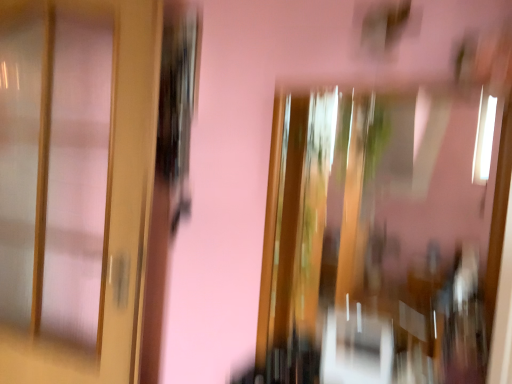
The width and height of the screenshot is (512, 384). In order to click on matte wood door at left in this screenshot , I will do [112, 204].

What do you see at coordinates (112, 204) in the screenshot? I see `matte wood door at left` at bounding box center [112, 204].

Measure the distance between matte wood door at left and camera.

The distance of matte wood door at left from camera is 1.28 meters.

What do you see at coordinates (383, 234) in the screenshot? The width and height of the screenshot is (512, 384). I see `transparent glass window at center` at bounding box center [383, 234].

The height and width of the screenshot is (384, 512). Identify the location of transparent glass window at center. (383, 234).

Identify the location of matte wood door at left. (112, 204).

Is transparent glass window at center at the right side of matte wood door at left?

Correct, you'll find transparent glass window at center to the right of matte wood door at left.

Is transparent glass window at center closer to the viewer compared to matte wood door at left?

Yes, transparent glass window at center is closer to the camera.

Is point (329, 192) farther from viewer compared to point (145, 77)?

Yes, it is.

From the image's perspective, which one is positioned higher, transparent glass window at center or matte wood door at left?

From the image's view, matte wood door at left is above.

From a real-world perspective, between transparent glass window at center and matte wood door at left, who is vertically lower?

transparent glass window at center, from a real-world perspective.

Looking at their sizes, would you say transparent glass window at center is wider or thinner than matte wood door at left?

Clearly, transparent glass window at center has less width compared to matte wood door at left.

Considering the relative sizes of transparent glass window at center and matte wood door at left in the image provided, is transparent glass window at center taller than matte wood door at left?

In fact, transparent glass window at center may be shorter than matte wood door at left.

Who is bigger, transparent glass window at center or matte wood door at left?

matte wood door at left.

Is transparent glass window at center spatially inside matte wood door at left, or outside of it?

transparent glass window at center lies outside matte wood door at left.

Is transparent glass window at center directly adjacent to matte wood door at left?

No, transparent glass window at center is not touching matte wood door at left.

Looking at this image, could you tell me if transparent glass window at center is turned towards matte wood door at left?

No, transparent glass window at center is not facing towards matte wood door at left.

How distant is transparent glass window at center from matte wood door at left?

A distance of 5.43 feet exists between transparent glass window at center and matte wood door at left.

Locate an element on the screen. The image size is (512, 384). window that is below the matte wood door at left (from the image's perspective) is located at coordinates coord(383,234).

Would you say matte wood door at left is to the left or to the right of transparent glass window at center in the picture?

In the image, matte wood door at left appears on the left side of transparent glass window at center.

Which object is more forward, matte wood door at left or transparent glass window at center?

transparent glass window at center is closer to the camera.

Between point (132, 62) and point (292, 280), which one is positioned behind?

The point (292, 280) is farther.

From the image's perspective, is matte wood door at left above or below transparent glass window at center?

matte wood door at left is situated higher than transparent glass window at center in the image.

From a real-world perspective, between matte wood door at left and transparent glass window at center, who is vertically lower?

From a 3D spatial view, transparent glass window at center is below.

Based on the photo, which object is thinner, matte wood door at left or transparent glass window at center?

transparent glass window at center is thinner.

In the scene shown: In terms of height, does matte wood door at left look taller or shorter compared to transparent glass window at center?

Clearly, matte wood door at left is taller compared to transparent glass window at center.

Looking at the image, does matte wood door at left seem bigger or smaller compared to transparent glass window at center?

matte wood door at left is bigger than transparent glass window at center.

Could transparent glass window at center be considered to be inside matte wood door at left?

Definitely not — transparent glass window at center is not inside matte wood door at left.

Is matte wood door at left next to transparent glass window at center?

matte wood door at left and transparent glass window at center are not in contact.

Is matte wood door at left turned away from transparent glass window at center?

matte wood door at left does not have its back to transparent glass window at center.

How different are the orientations of matte wood door at left and transparent glass window at center in degrees?

There is a 8.32-degree angle between the facing directions of matte wood door at left and transparent glass window at center.

Measure the distance between matte wood door at left and transparent glass window at center.

They are 1.65 meters apart.

At what (x,y) coordinates should I click in order to perform the action: click on door above the transparent glass window at center (from the image's perspective). Please return your answer as a coordinate pair (x, y). Image resolution: width=512 pixels, height=384 pixels. Looking at the image, I should click on (112, 204).

At what (x,y) coordinates should I click in order to perform the action: click on door behind the transparent glass window at center. Please return your answer as a coordinate pair (x, y). This screenshot has width=512, height=384. Looking at the image, I should click on (112, 204).

Where is `door lying above the transparent glass window at center (from the image's perspective)`? door lying above the transparent glass window at center (from the image's perspective) is located at coordinates (112, 204).